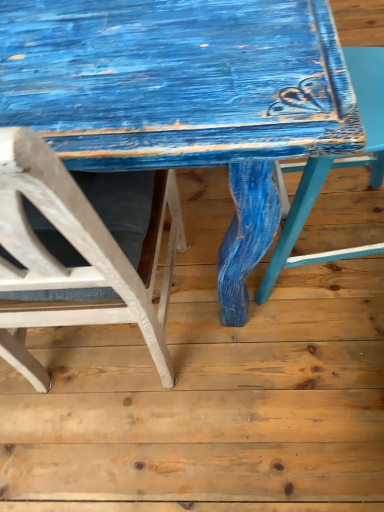
Question: Considering the relative sizes of distressed blue wood table at center and white matte chair at left, placed as the second chair when sorted from right to left, in the image provided, is distressed blue wood table at center thinner than white matte chair at left, placed as the second chair when sorted from right to left,?

Choices:
 (A) no
 (B) yes

Answer: (A)

Question: Can you confirm if distressed blue wood table at center is smaller than white matte chair at left, placed as the second chair when sorted from right to left?

Choices:
 (A) no
 (B) yes

Answer: (A)

Question: Is distressed blue wood table at center aimed at white matte chair at left, placed as the first chair when sorted from left to right?

Choices:
 (A) no
 (B) yes

Answer: (A)

Question: Is the depth of distressed blue wood table at center greater than that of white matte chair at left, placed as the first chair when sorted from left to right?

Choices:
 (A) yes
 (B) no

Answer: (A)

Question: Is white matte chair at left, placed as the first chair when sorted from left to right, surrounded by distressed blue wood table at center?

Choices:
 (A) no
 (B) yes

Answer: (A)

Question: Is white matte chair at left, placed as the first chair when sorted from left to right, in front of or behind matte blue chair at right, which is the first chair in right-to-left order, in the image?

Choices:
 (A) behind
 (B) front

Answer: (B)

Question: Is white matte chair at left, placed as the first chair when sorted from left to right, to the left or to the right of matte blue chair at right, which is the 2th chair from left to right, in the image?

Choices:
 (A) left
 (B) right

Answer: (A)

Question: Is point (6, 331) positioned closer to the camera than point (364, 148)?

Choices:
 (A) closer
 (B) farther

Answer: (B)

Question: Considering the positions of white matte chair at left, placed as the second chair when sorted from right to left, and matte blue chair at right, which is the first chair in right-to-left order, in the image, is white matte chair at left, placed as the second chair when sorted from right to left, wider or thinner than matte blue chair at right, which is the first chair in right-to-left order,?

Choices:
 (A) thin
 (B) wide

Answer: (B)

Question: Relative to matte blue chair at right, which is the first chair in right-to-left order, is distressed blue wood table at center in front or behind?

Choices:
 (A) front
 (B) behind

Answer: (B)

Question: Is point (77, 91) positioned closer to the camera than point (334, 157)?

Choices:
 (A) farther
 (B) closer

Answer: (B)

Question: From a real-world perspective, is distressed blue wood table at center physically located above or below matte blue chair at right, which is the first chair in right-to-left order?

Choices:
 (A) below
 (B) above

Answer: (A)

Question: From the image's perspective, is distressed blue wood table at center located above or below matte blue chair at right, which is the first chair in right-to-left order?

Choices:
 (A) above
 (B) below

Answer: (A)

Question: From a real-world perspective, relative to white matte chair at left, placed as the second chair when sorted from right to left, is distressed blue wood table at center vertically above or below?

Choices:
 (A) below
 (B) above

Answer: (A)

Question: Looking at their shapes, would you say distressed blue wood table at center is wider or thinner than white matte chair at left, placed as the first chair when sorted from left to right?

Choices:
 (A) thin
 (B) wide

Answer: (B)